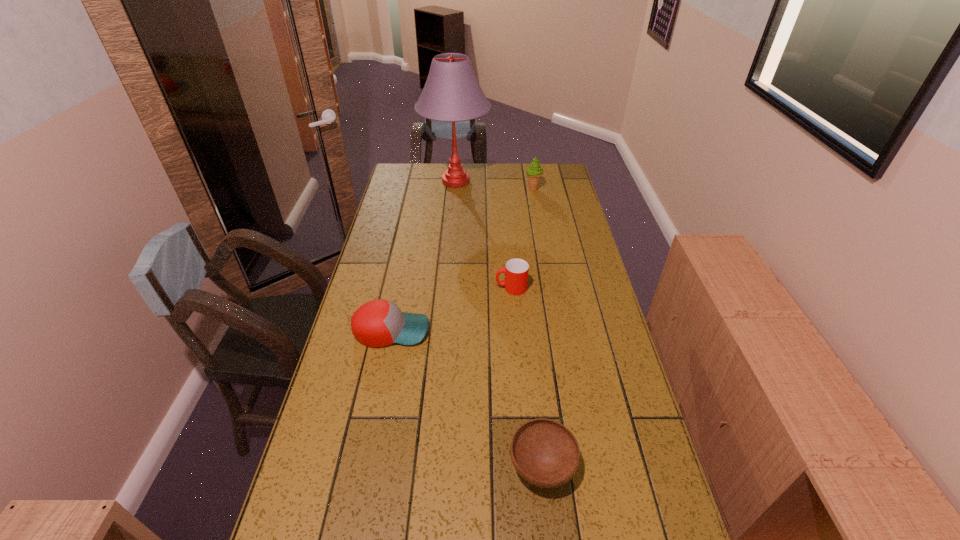
You are a GUI agent. You are given a task and a screenshot of the screen. Output one action in this format:
    pyautogui.click(x=<x>, y=<y>)
    Task: Click on the table lamp
    Image resolution: width=960 pixels, height=540 pixels.
    Given the screenshot: What is the action you would take?
    pyautogui.click(x=452, y=93)

Find the location of a particular element. the fourth shortest object is located at coordinates (534, 172).

Image resolution: width=960 pixels, height=540 pixels. In order to click on cup in this screenshot , I will do `click(516, 271)`.

Locate an element on the screen. The width and height of the screenshot is (960, 540). the second nearest object is located at coordinates (378, 323).

I want to click on bowl, so pyautogui.click(x=545, y=453).

Image resolution: width=960 pixels, height=540 pixels. In order to click on vacant region located 0.150m on the front-facing side of the tallest object in this screenshot , I will do `click(522, 181)`.

The image size is (960, 540). In order to click on blank space located on the left of the icecream in this screenshot , I will do `click(507, 189)`.

At what (x,y) coordinates should I click in order to perform the action: click on vacant region located on the side of the cup with the handle. Please return your answer as a coordinate pair (x, y). Image resolution: width=960 pixels, height=540 pixels. Looking at the image, I should click on (420, 288).

Locate an element on the screen. Image resolution: width=960 pixels, height=540 pixels. free spot located on the side of the cup with the handle is located at coordinates (443, 288).

I want to click on vacant space located on the side of the cup with the handle, so click(411, 288).